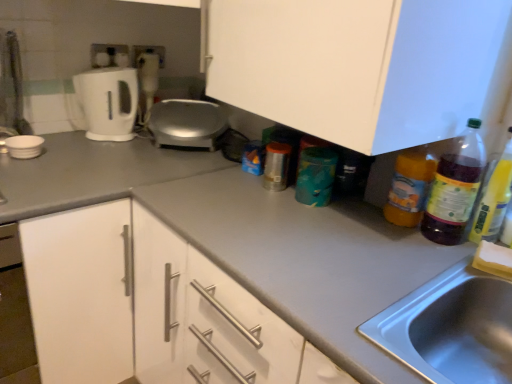
The width and height of the screenshot is (512, 384). I want to click on free space between satin silver appliance at center, placed as the second appliance when sorted from front to back, and white matte bowl at left, which is the second appliance from right to left, so click(102, 149).